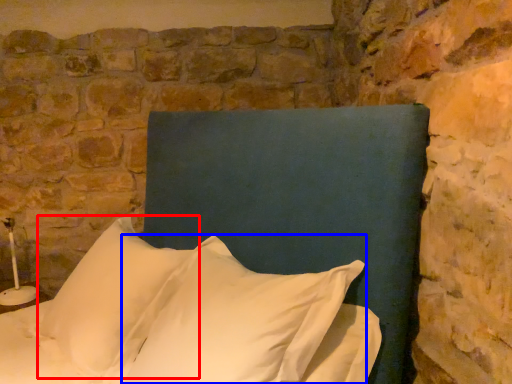
Question: Among these objects, which one is farthest to the camera, pillow (highlighted by a red box) or pillow (highlighted by a blue box)?

Choices:
 (A) pillow
 (B) pillow

Answer: (A)